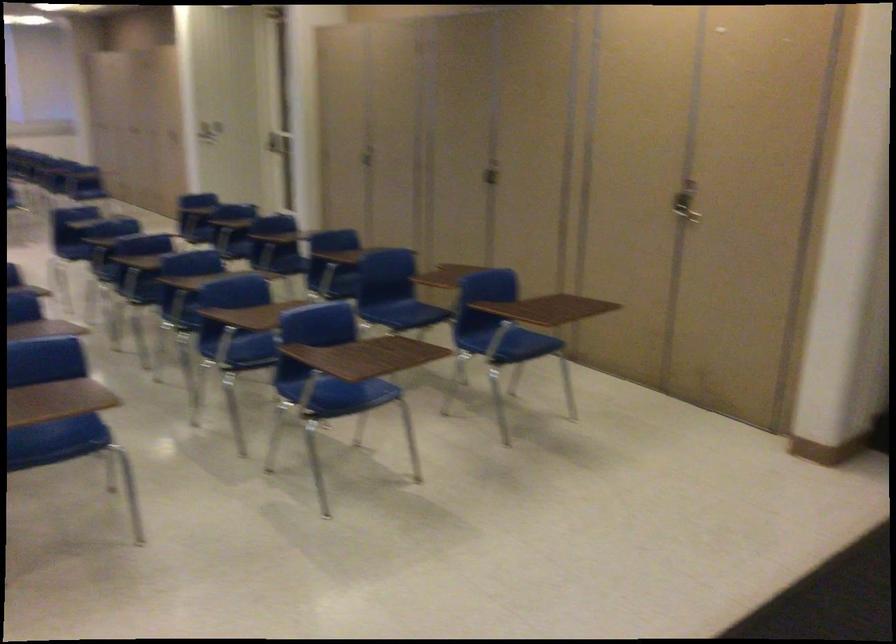
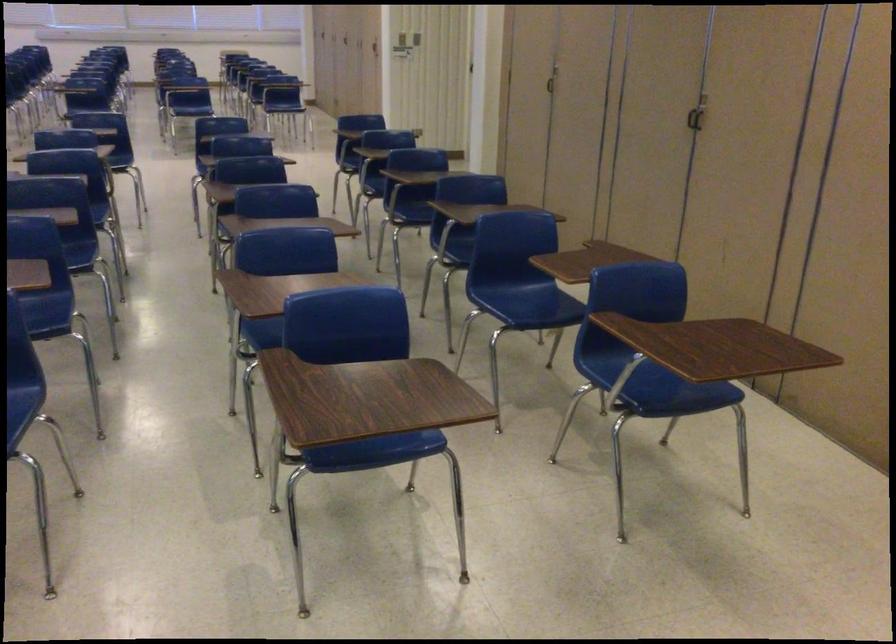
Question: Which direction would the cameraman need to move to produce the second image? Reply with the corresponding letter.

Choices:
 (A) Left
 (B) Right
 (C) Forward
 (D) Backward

Answer: (C)